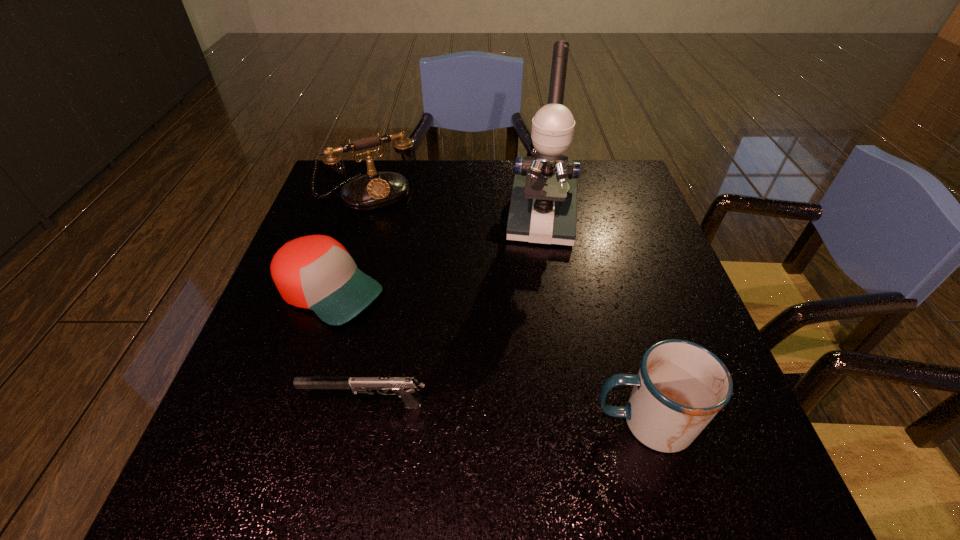
Locate an element on the screen. The image size is (960, 540). the shortest object is located at coordinates (405, 387).

Identify the location of mug. (680, 387).

Where is `the third farthest object`? The height and width of the screenshot is (540, 960). the third farthest object is located at coordinates (316, 272).

The image size is (960, 540). I want to click on baseball cap, so click(x=316, y=272).

Find the location of a particular element. Image resolution: width=960 pixels, height=540 pixels. telephone is located at coordinates (375, 190).

The height and width of the screenshot is (540, 960). What are the coordinates of `the tallest object` in the screenshot? It's located at (543, 208).

The height and width of the screenshot is (540, 960). I want to click on vacant position located at the muzzle end of the shortest object, so click(225, 404).

At what (x,y) coordinates should I click in order to perform the action: click on vacant space located at the muzzle end of the shortest object. Please return your answer as a coordinate pair (x, y). Looking at the image, I should click on (241, 404).

Find the location of a particular element. The image size is (960, 540). free region located 0.130m at the muzzle end of the shortest object is located at coordinates (236, 404).

Image resolution: width=960 pixels, height=540 pixels. Find the location of `vacant space located on the handle side of the mug`. vacant space located on the handle side of the mug is located at coordinates (548, 422).